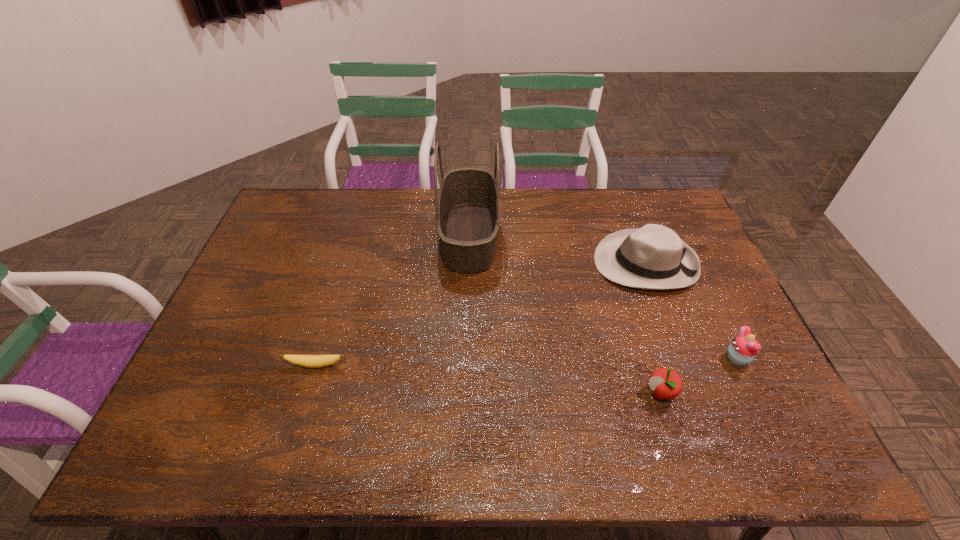
The image size is (960, 540). I want to click on free space between the leftmost object and the apple, so click(489, 379).

Find the location of `vacant point located between the second tallest object and the cupcake`. vacant point located between the second tallest object and the cupcake is located at coordinates (691, 310).

You are a GUI agent. You are given a task and a screenshot of the screen. Output one action in this format:
    pyautogui.click(x=<x>, y=<y>)
    Task: Click on the unoccupied area between the basket and the shortest object
    
    Given the screenshot: What is the action you would take?
    pyautogui.click(x=393, y=300)

At what (x,y) coordinates should I click in order to perform the action: click on vacant area that lies between the fourth shortest object and the cupcake. Please return your answer as a coordinate pair (x, y). The width and height of the screenshot is (960, 540). Looking at the image, I should click on (691, 310).

The height and width of the screenshot is (540, 960). Identify the location of empty location between the banana and the fedora. (481, 314).

Choose which object is the fourth nearest neighbor to the tallest object. Please provide its 2D coordinates. Your answer should be formatted as a tuple, i.e. [(x, y)], where the tuple contains the x and y coordinates of a point satisfying the conditions above.

[(742, 350)]

Locate an element on the screen. object that ranks as the third closest to the cupcake is located at coordinates [x=467, y=206].

This screenshot has width=960, height=540. Find the location of `vacant space that satisfies the following two spatial constraints: 1. on the front-facing side of the fedora; 2. on the front side of the apple`. vacant space that satisfies the following two spatial constraints: 1. on the front-facing side of the fedora; 2. on the front side of the apple is located at coordinates (693, 393).